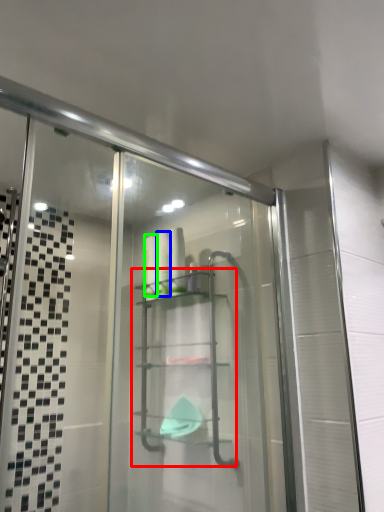
Question: Considering the real-world distances, which object is farthest from glass box (highlighted by a red box)? toiletry (highlighted by a blue box) or toiletry (highlighted by a green box)?

Choices:
 (A) toiletry
 (B) toiletry

Answer: (B)